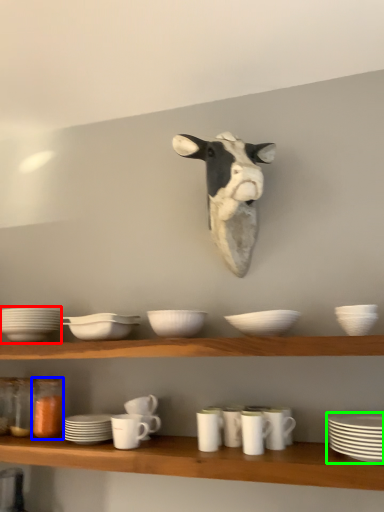
Question: Estimate the real-world distances between objects in this image. Which object is farther from tableware (highlighted by a red box), glass jar (highlighted by a blue box) or platter (highlighted by a green box)?

Choices:
 (A) glass jar
 (B) platter

Answer: (B)